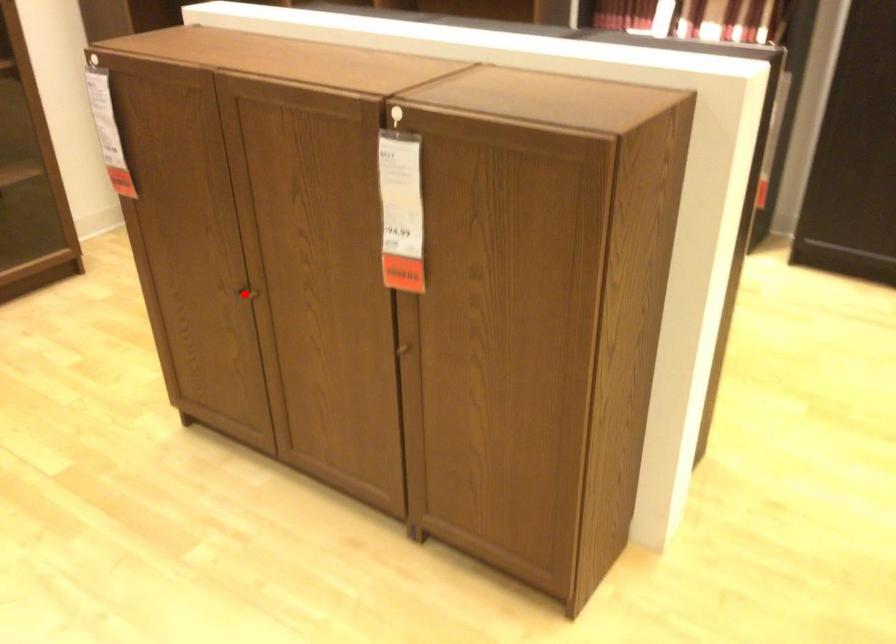
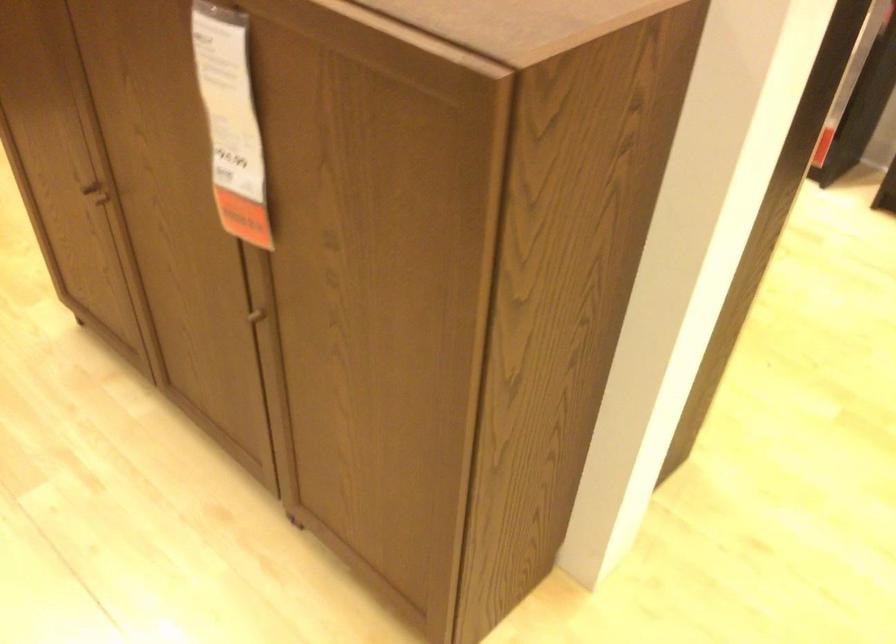
The point at the highlighted location is marked in the first image. Where is the corresponding point in the second image?

(95, 196)